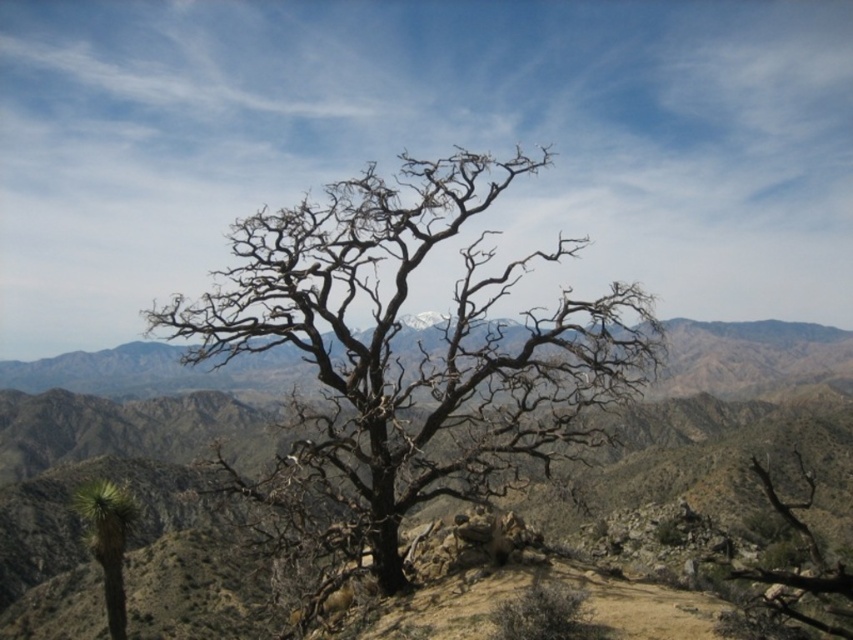
Question: Does brown/dry bark tree at center have a lesser width compared to bare wood tree at center?

Choices:
 (A) yes
 (B) no

Answer: (B)

Question: Which of these objects is positioned farthest from the bare wood tree at center?

Choices:
 (A) green spiky cactus at lower left
 (B) brown/dry bark tree at center

Answer: (B)

Question: Which object appears closest to the camera in this image?

Choices:
 (A) bare wood tree at center
 (B) green spiky cactus at lower left
 (C) brown/dry bark tree at center

Answer: (A)

Question: Among these points, which one is farthest from the camera?

Choices:
 (A) (108, 593)
 (B) (804, 529)

Answer: (A)

Question: Can you confirm if bare wood tree at center is positioned to the right of green spiky cactus at lower left?

Choices:
 (A) no
 (B) yes

Answer: (B)

Question: Does brown/dry bark tree at center appear under bare wood tree at center?

Choices:
 (A) yes
 (B) no

Answer: (A)